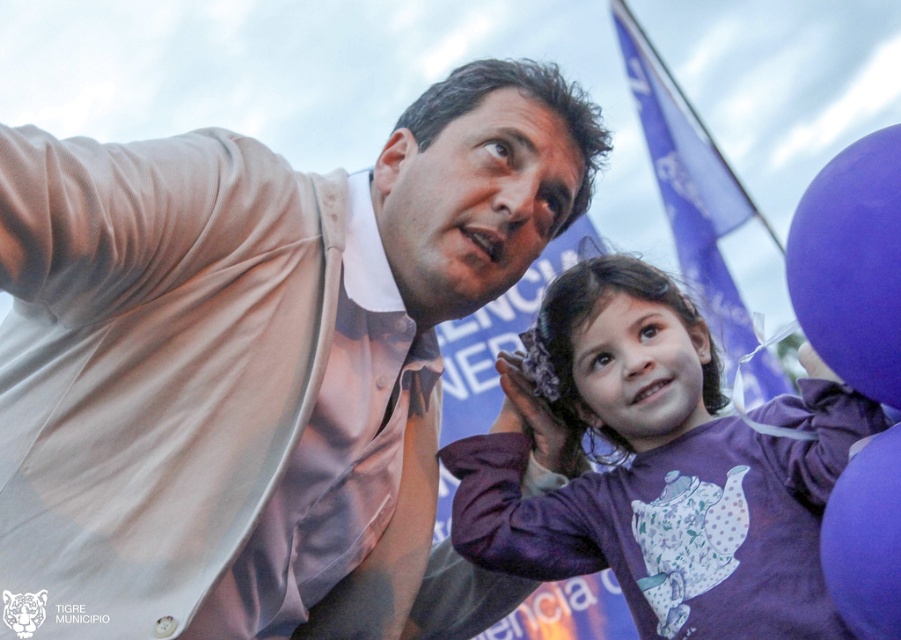
Which is more to the left, purple matte shirt at center or purple matte balloon at right?

purple matte shirt at center

Does point (827, 454) lie behind point (895, 620)?

Yes, it is.

Between point (684, 513) and point (862, 564), which one is positioned behind?

Positioned behind is point (684, 513).

Locate an element on the screen. The width and height of the screenshot is (901, 640). purple matte shirt at center is located at coordinates (658, 467).

Does satin beige shirt at upper left lie behind purple fabric flag at upper right?

No, it is in front of purple fabric flag at upper right.

Does satin beige shirt at upper left appear on the right side of purple fabric flag at upper right?

In fact, satin beige shirt at upper left is to the left of purple fabric flag at upper right.

Between point (334, 330) and point (705, 317), which one is positioned in front?

Point (334, 330)

The height and width of the screenshot is (640, 901). In order to click on satin beige shirt at upper left in this screenshot , I will do point(259,365).

Is satin beige shirt at upper left to the left of purple matte shirt at center from the viewer's perspective?

Yes, satin beige shirt at upper left is to the left of purple matte shirt at center.

Who is more forward, (351, 262) or (686, 547)?

Point (686, 547) is more forward.

The height and width of the screenshot is (640, 901). What are the coordinates of `satin beige shirt at upper left` in the screenshot? It's located at (259, 365).